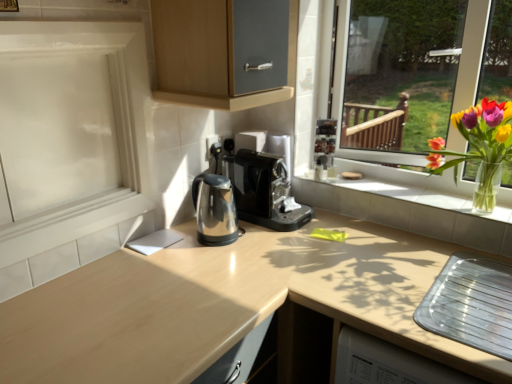
What do you see at coordinates (398, 185) in the screenshot?
I see `white tile window sill at center` at bounding box center [398, 185].

Find the location of `polished metallic kettle at center`. polished metallic kettle at center is located at coordinates (215, 210).

From their relative heights in the image, would you say white tile window sill at center is taller or shorter than white glossy screen door at left?

Considering their sizes, white tile window sill at center has less height than white glossy screen door at left.

From the picture: Between white tile window sill at center and white glossy screen door at left, which one has smaller width?

white glossy screen door at left is thinner.

Is white tile window sill at center turned away from white glossy screen door at left?

white tile window sill at center does not have its back to white glossy screen door at left.

Is polished metallic kettle at center at the right side of black plastic coffee machine at center?

No.

Is black plastic coffee machine at center a part of polished metallic kettle at center?

No, black plastic coffee machine at center is not surrounded by polished metallic kettle at center.

In terms of height, does polished metallic kettle at center look taller or shorter compared to black plastic coffee machine at center?

Considering their sizes, polished metallic kettle at center has less height than black plastic coffee machine at center.

Which object is more forward, polished metallic kettle at center or black plastic coffee machine at center?

polished metallic kettle at center is in front.

Is black plastic coffee machine at center at the back of white glossy screen door at left?

No.

Considering the positions of objects white glossy screen door at left and black plastic coffee machine at center in the image provided, who is more to the left, white glossy screen door at left or black plastic coffee machine at center?

From the viewer's perspective, white glossy screen door at left appears more on the left side.

Is there a large distance between white glossy screen door at left and black plastic coffee machine at center?

white glossy screen door at left is actually quite close to black plastic coffee machine at center.

Looking at this image, can you confirm if white glossy screen door at left is taller than black plastic coffee machine at center?

Yes.

Are polished metallic kettle at center and white glossy screen door at left making contact?

No, polished metallic kettle at center is not touching white glossy screen door at left.

From a real-world perspective, is polished metallic kettle at center positioned over white glossy screen door at left based on gravity?

Incorrect, from a real-world perspective, polished metallic kettle at center is lower than white glossy screen door at left.

Could you tell me if polished metallic kettle at center is turned towards white glossy screen door at left?

No, polished metallic kettle at center is not facing towards white glossy screen door at left.

Between polished metallic kettle at center and white glossy screen door at left, which one has less height?

With less height is polished metallic kettle at center.

Could you tell me if translucent glass vase at right is turned towards polished metallic kettle at center?

No, translucent glass vase at right is not turned towards polished metallic kettle at center.

Is translucent glass vase at right shorter than polished metallic kettle at center?

In fact, translucent glass vase at right may be taller than polished metallic kettle at center.

Which is less distant, [466,137] or [206,227]?

Point [466,137]

Is translucent glass vase at right in front of or behind polished metallic kettle at center in the image?

translucent glass vase at right is in front of polished metallic kettle at center.

Locate an element on the screen. The height and width of the screenshot is (384, 512). coffee machine behind the white glossy screen door at left is located at coordinates (x=266, y=192).

Can we say black plastic coffee machine at center lies outside white glossy screen door at left?

Yes.

From a real-world perspective, is black plastic coffee machine at center physically below white glossy screen door at left?

Yes, from a real-world perspective, black plastic coffee machine at center is beneath white glossy screen door at left.

How far apart are polished metallic kettle at center and white tile window sill at center?

polished metallic kettle at center is 59.52 centimeters from white tile window sill at center.

Considering their positions, is polished metallic kettle at center located in front of or behind white tile window sill at center?

Clearly, polished metallic kettle at center is behind white tile window sill at center.

Would you say polished metallic kettle at center is a long distance from white tile window sill at center?

That's not correct — polished metallic kettle at center is a little close to white tile window sill at center.

You are a GUI agent. You are given a task and a screenshot of the screen. Output one action in this format:
    pyautogui.click(x=<x>, y=<y>)
    Task: Click on the window sill directly beneath the white glossy screen door at left (from a real-world perspective)
    
    Given the screenshot: What is the action you would take?
    pyautogui.click(x=398, y=185)

In the image, there is a polished metallic kettle at center. Where is `coffee machine above it (from the image's perspective)`? This screenshot has width=512, height=384. coffee machine above it (from the image's perspective) is located at coordinates (266, 192).

Estimate the real-world distances between objects in this image. Which object is further from black plastic coffee machine at center, white tile window sill at center or white glossy screen door at left?

white glossy screen door at left.

Which object lies further to the anchor point translucent glass vase at right, white tile window sill at center or black plastic coffee machine at center?

black plastic coffee machine at center is positioned further to the anchor translucent glass vase at right.

From the picture: From the image, which object appears to be farther from polished metallic kettle at center, black plastic coffee machine at center or white glossy screen door at left?

white glossy screen door at left is further to polished metallic kettle at center.

When comparing their distances from polished metallic kettle at center, does translucent glass vase at right or white tile window sill at center seem closer?

Based on the image, white tile window sill at center appears to be nearer to polished metallic kettle at center.

Which object lies further to the anchor point white tile window sill at center, black plastic coffee machine at center or polished metallic kettle at center?

Among the two, polished metallic kettle at center is located further to white tile window sill at center.

Estimate the real-world distances between objects in this image. Which object is closer to black plastic coffee machine at center, polished metallic kettle at center or white tile window sill at center?

Among the two, polished metallic kettle at center is located nearer to black plastic coffee machine at center.

Looking at the image, which one is located closer to polished metallic kettle at center, translucent glass vase at right or black plastic coffee machine at center?

black plastic coffee machine at center is closer to polished metallic kettle at center.

Considering their positions, is black plastic coffee machine at center positioned closer to polished metallic kettle at center than translucent glass vase at right?

Based on the image, black plastic coffee machine at center appears to be nearer to polished metallic kettle at center.

This screenshot has width=512, height=384. Identify the location of coffee machine between white glossy screen door at left and translucent glass vase at right from left to right. (266, 192).

The height and width of the screenshot is (384, 512). I want to click on window sill situated between black plastic coffee machine at center and translucent glass vase at right from left to right, so click(x=398, y=185).

This screenshot has height=384, width=512. Identify the location of window sill between white glossy screen door at left and translucent glass vase at right from left to right. (398, 185).

Find the location of a particular element. coffeepot located between white glossy screen door at left and black plastic coffee machine at center in the left-right direction is located at coordinates (215, 210).